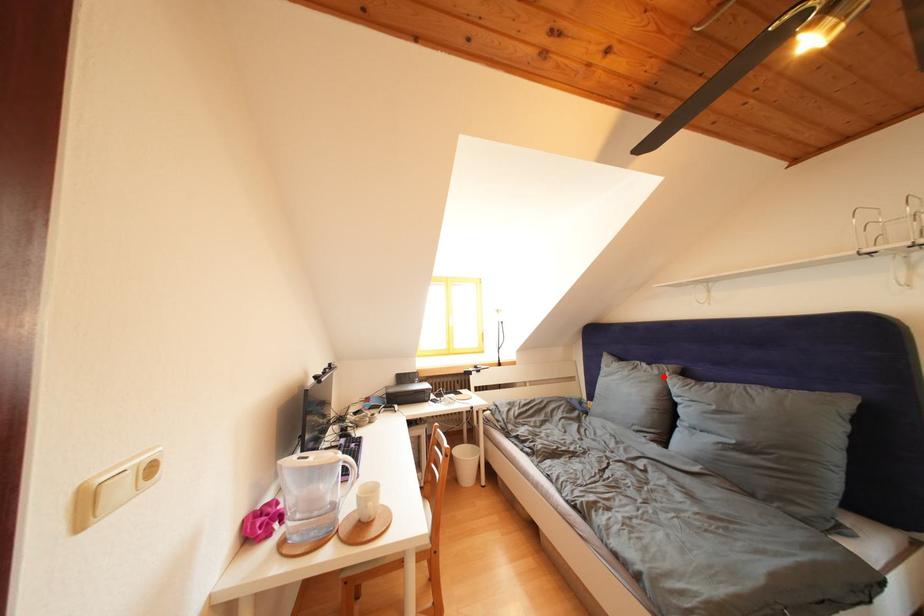
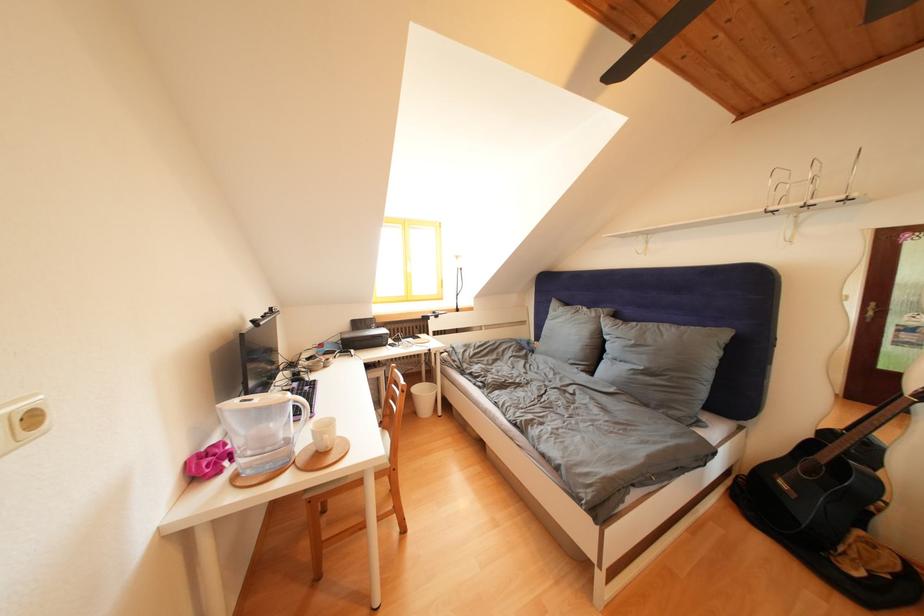
Find the pixel in the second image that matches the highlighted location in the first image.

(602, 320)